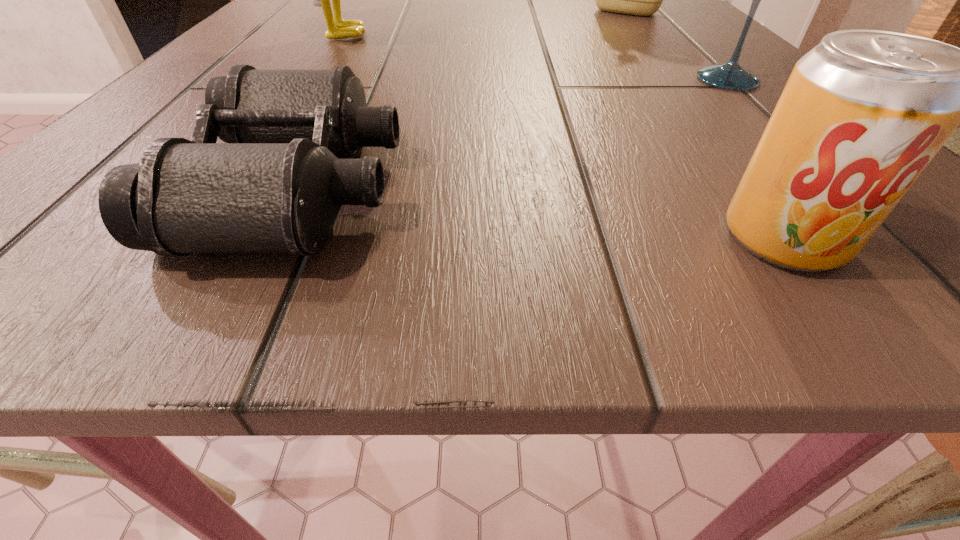
Identify the location of vacant area between the third tallest object and the gull. Image resolution: width=960 pixels, height=540 pixels. coord(533,57).

I want to click on free area in between the gull and the detergent, so click(x=482, y=23).

Find the location of a particular element. Image resolution: width=960 pixels, height=540 pixels. blank region between the binoculars and the pop (soda) is located at coordinates (540, 213).

The width and height of the screenshot is (960, 540). I want to click on free space that is in between the gull and the detergent, so click(x=482, y=23).

At what (x,y) coordinates should I click in order to perform the action: click on free space between the binoculars and the third nearest object. Please return your answer as a coordinate pair (x, y). Looking at the image, I should click on (513, 133).

Where is `free space between the shortest object and the third farthest object`? The height and width of the screenshot is (540, 960). free space between the shortest object and the third farthest object is located at coordinates (513, 133).

Locate an element on the screen. This screenshot has height=540, width=960. vacant point located between the binoculars and the pop (soda) is located at coordinates (540, 213).

You are a GUI agent. You are given a task and a screenshot of the screen. Output one action in this format:
    pyautogui.click(x=<x>, y=<y>)
    Task: Click on the vacant region between the shortest object and the detergent
    Image resolution: width=960 pixels, height=540 pixels.
    Given the screenshot: What is the action you would take?
    pyautogui.click(x=462, y=99)

Find the location of a particular element. The image size is (960, 540). free space between the shortest object and the pop (soda) is located at coordinates (540, 213).

Select which object appears as the fourth closest to the tallest object. Please provide its 2D coordinates. Your answer should be formatted as a tuple, i.e. [(x, y)], where the tuple contains the x and y coordinates of a point satisfying the conditions above.

[(863, 113)]